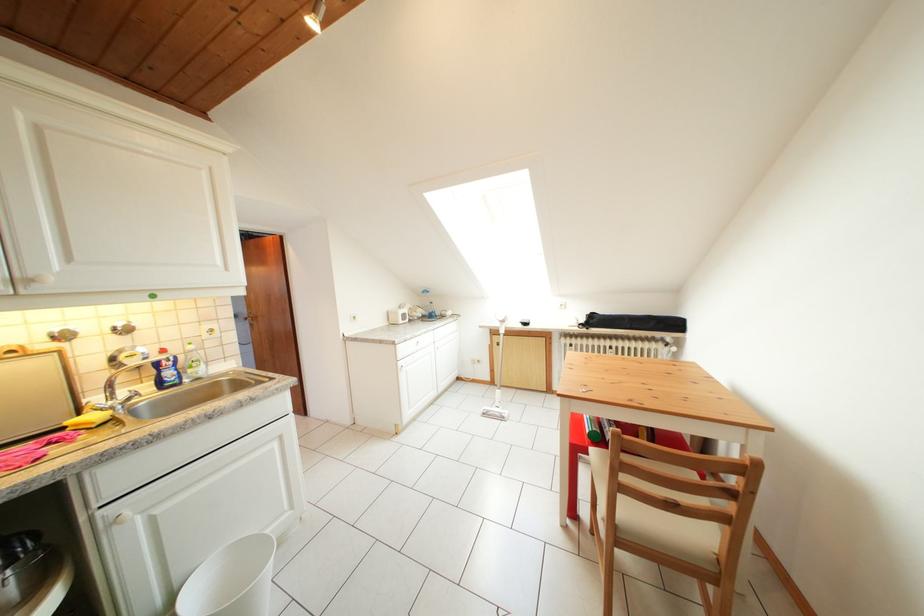
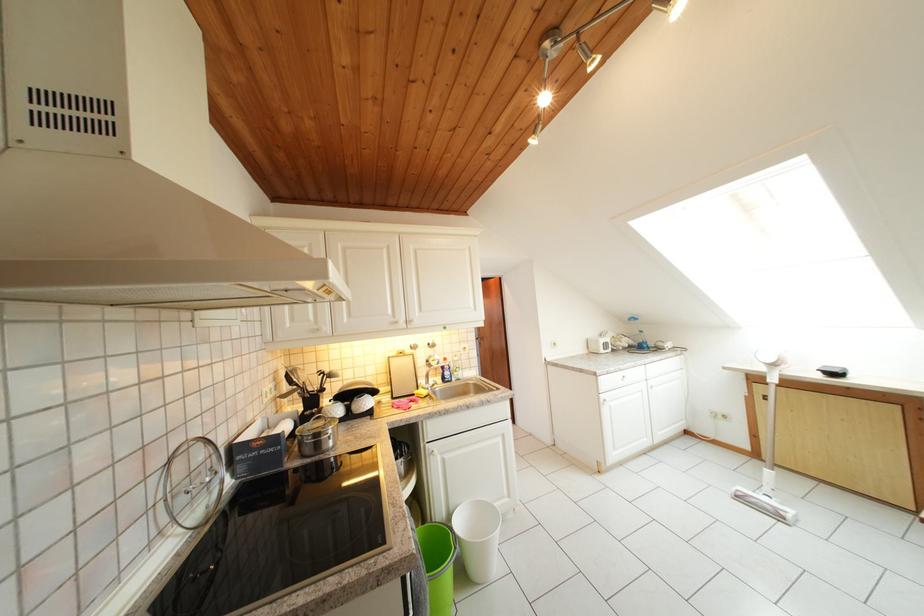
The point at (406, 318) is marked in the first image. Where is the corresponding point in the second image?

(605, 347)